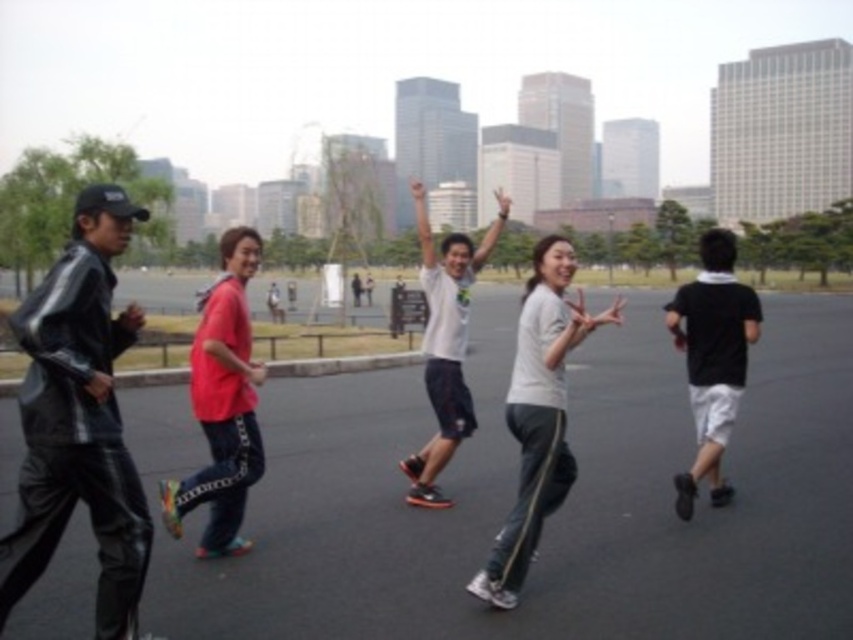
Question: Can you confirm if shiny black jacket at left is thinner than black matte shorts at right?

Choices:
 (A) no
 (B) yes

Answer: (B)

Question: Which object is the closest to the shiny black jacket at left?

Choices:
 (A) white matte pants at center
 (B) white matte shirt at center
 (C) red matte skateboard at center
 (D) black matte shorts at right

Answer: (A)

Question: Observing the image, what is the correct spatial positioning of shiny black jacket at left in reference to white matte pants at center?

Choices:
 (A) above
 (B) below

Answer: (A)

Question: Which point is closer to the camera?

Choices:
 (A) red matte skateboard at center
 (B) white matte shirt at center

Answer: (A)

Question: Which object is positioned farthest from the black matte shorts at right?

Choices:
 (A) red matte skateboard at center
 (B) white matte pants at center
 (C) white matte shirt at center

Answer: (A)

Question: Can you confirm if red matte skateboard at center is positioned to the left of black matte shorts at right?

Choices:
 (A) no
 (B) yes

Answer: (B)